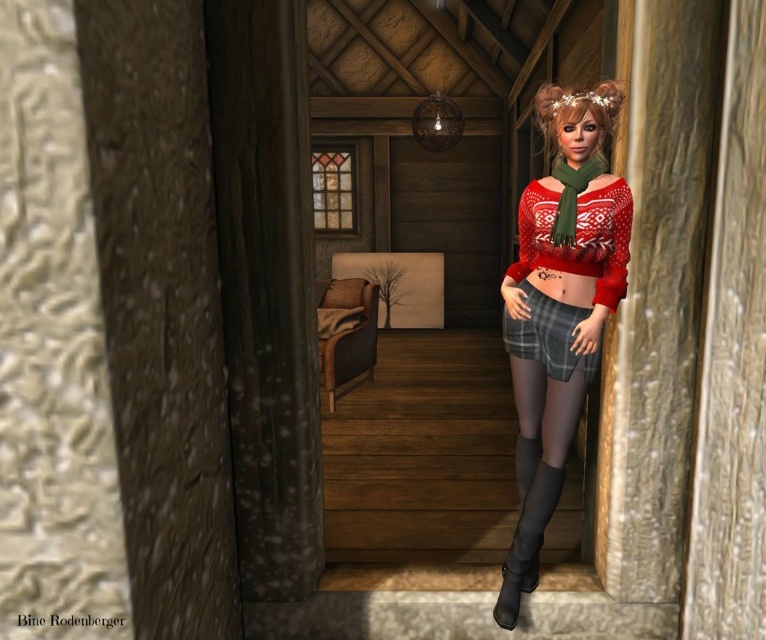
You are standing in front of the doorway and looking into the room. There is a point marked at coordinates (558, 308) in the image. What object is located at that point?

The point at coordinates (558, 308) corresponds to the red matte sweater at center.

You are a guest entering through the doorway and notice a black leather boot at lower right and a blonde silky hair at upper center. Which object is narrower when viewed from your perspective?

The black leather boot at lower right is thinner than the blonde silky hair at upper center, so the black leather boot at lower right is narrower.

You are standing in the doorway and see the red matte sweater at center and the black leather boot at lower right. Which object is taller?

The red matte sweater at center is much taller than the black leather boot at lower right.